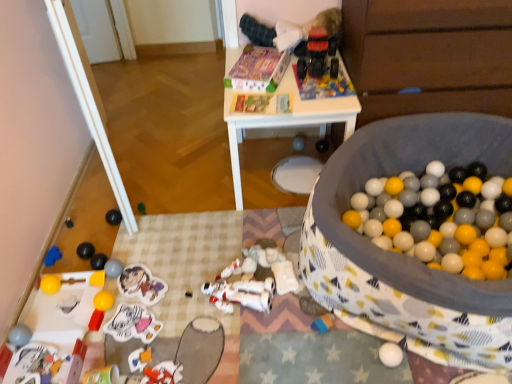
At what (x,y) coordinates should I click in order to perform the action: click on vacant area that lies between yellow rubber ball at lower left, positioned as the 9th toy in left-to-right order, and white fabric doll at center, placed as the fifth toy when sorted from right to left. Please return your answer as a coordinate pair (x, y). This screenshot has height=384, width=512. Looking at the image, I should click on (184, 296).